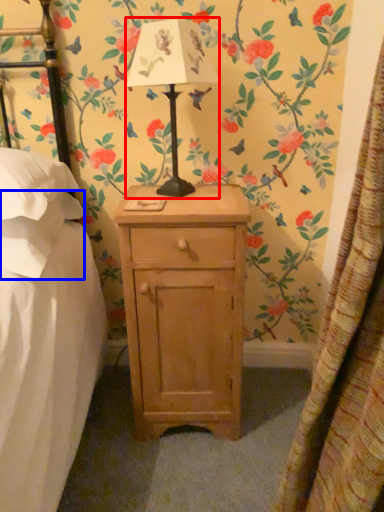
Question: Which object is closer to the camera taking this photo, table lamp (highlighted by a red box) or pillow (highlighted by a blue box)?

Choices:
 (A) table lamp
 (B) pillow

Answer: (A)